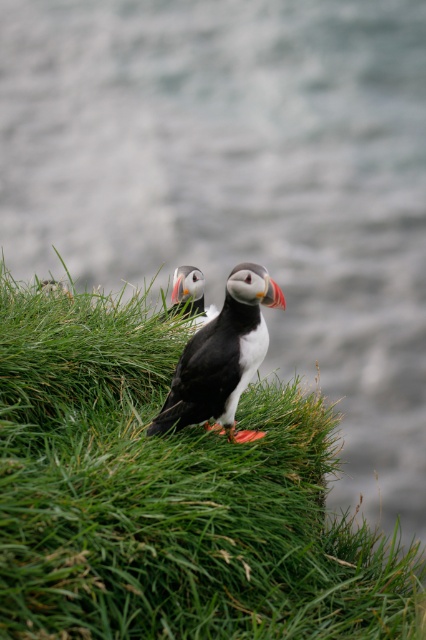
You are a photographer trying to capture both the green grassy at center and the black matte puffin at center in a single frame. Based on their widths, which object would occupy more space horizontally in the photo?

The green grassy at center has a greater width than the black matte puffin at center, so it would occupy more horizontal space in the photo.

You are a wildlife photographer aiming to capture both the black matte puffin at center and the orange beak puffin at center in a single frame. Given their sizes, which puffin should you focus on first to ensure both fit in the shot?

The black matte puffin at center is bigger than the orange beak puffin at center, so you should focus on the larger black matte puffin at center first to ensure both fit in the frame by adjusting the zoom accordingly.

You are a birdwatcher trying to identify the puffin in the image. You notice two elements at the center of the image. Which one is bigger between the green grassy at center and the orange beak puffin at center?

The green grassy at center has a larger size compared to the orange beak puffin at center, so the green grassy at center is bigger.